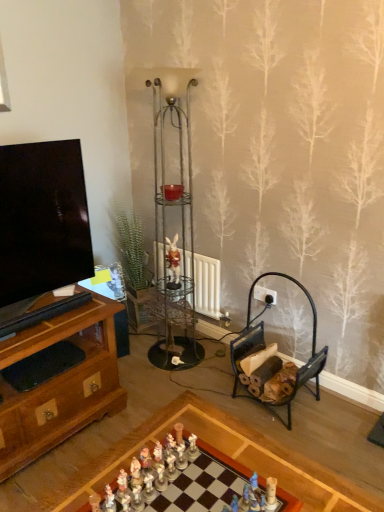
This screenshot has height=512, width=384. In order to click on empty space that is to the right of black metal firewood rack at lower right in this screenshot , I will do `click(344, 415)`.